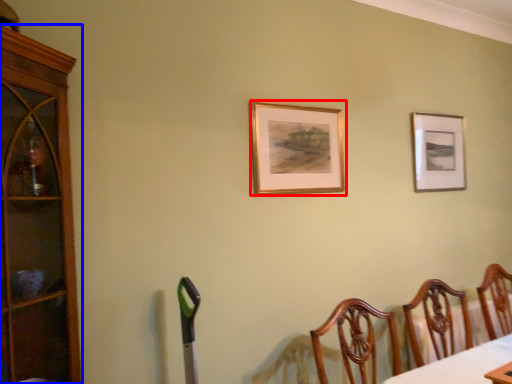
Question: Among these objects, which one is nearest to the camera, picture frame (highlighted by a red box) or cabinetry (highlighted by a blue box)?

Choices:
 (A) picture frame
 (B) cabinetry

Answer: (B)